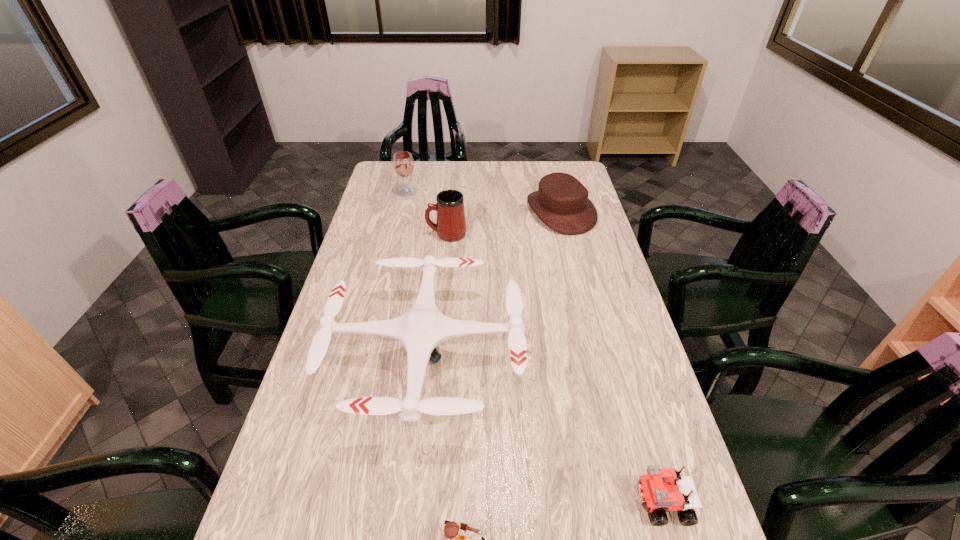
What are the coordinates of `the fourth closest object to the mug` in the screenshot? It's located at 660,488.